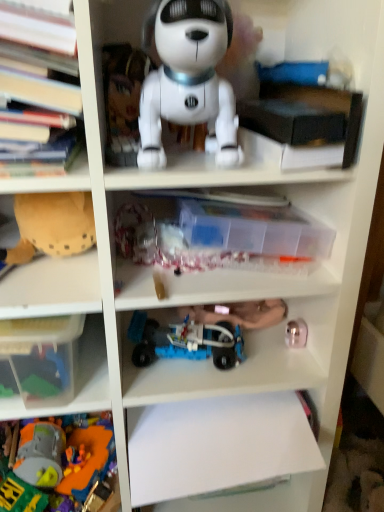
Question: Is translucent plastic storage box at lower left surrounded by hardcover books at left, the 3th book when ordered from right to left?

Choices:
 (A) no
 (B) yes

Answer: (A)

Question: Is hardcover books at left, which is counted as the 1th book, starting from the left, facing towards translucent plastic storage box at lower left?

Choices:
 (A) yes
 (B) no

Answer: (B)

Question: Does hardcover books at left, the 3th book when ordered from right to left, have a greater width compared to translucent plastic storage box at lower left?

Choices:
 (A) yes
 (B) no

Answer: (A)

Question: From a real-world perspective, is hardcover books at left, the 3th book when ordered from right to left, positioned under translucent plastic storage box at lower left based on gravity?

Choices:
 (A) no
 (B) yes

Answer: (A)

Question: Does hardcover books at left, which is counted as the 1th book, starting from the left, have a smaller size compared to translucent plastic storage box at lower left?

Choices:
 (A) yes
 (B) no

Answer: (B)

Question: From a real-world perspective, is blue plastic toy car at center, the 2th toy in the bottom-to-top sequence, above or below brown fabric toy at left, the fourth toy positioned from the bottom?

Choices:
 (A) below
 (B) above

Answer: (A)

Question: In terms of width, does blue plastic toy car at center, the 2th toy in the bottom-to-top sequence, look wider or thinner when compared to brown fabric toy at left, the fourth toy positioned from the bottom?

Choices:
 (A) thin
 (B) wide

Answer: (A)

Question: Considering the positions of blue plastic toy car at center, the fourth toy positioned from the top, and brown fabric toy at left, the fourth toy positioned from the bottom, in the image, is blue plastic toy car at center, the fourth toy positioned from the top, taller or shorter than brown fabric toy at left, the fourth toy positioned from the bottom,?

Choices:
 (A) tall
 (B) short

Answer: (B)

Question: From the image's perspective, is blue plastic toy car at center, the 2th toy in the bottom-to-top sequence, above or below brown fabric toy at left, the fourth toy positioned from the bottom?

Choices:
 (A) above
 (B) below

Answer: (B)

Question: From a real-world perspective, relative to hardcover books at left, the 3th book when ordered from right to left, is metallic gold toy at lower right, marked as the third toy in a bottom-to-top arrangement, vertically above or below?

Choices:
 (A) above
 (B) below

Answer: (B)

Question: Considering their positions, is metallic gold toy at lower right, marked as the third toy in a bottom-to-top arrangement, located in front of or behind hardcover books at left, which is counted as the 1th book, starting from the left?

Choices:
 (A) behind
 (B) front

Answer: (A)

Question: In terms of height, does metallic gold toy at lower right, positioned as the 3th toy in top-to-bottom order, look taller or shorter compared to hardcover books at left, the 3th book when ordered from right to left?

Choices:
 (A) short
 (B) tall

Answer: (A)

Question: From the image's perspective, is metallic gold toy at lower right, positioned as the 3th toy in top-to-bottom order, above or below hardcover books at left, which is counted as the 1th book, starting from the left?

Choices:
 (A) above
 (B) below

Answer: (B)

Question: Relative to brown fabric toy at left, the fourth toy positioned from the bottom, is metallic gold toy at lower right, positioned as the 3th toy in top-to-bottom order, in front or behind?

Choices:
 (A) behind
 (B) front

Answer: (A)

Question: From the image's perspective, is metallic gold toy at lower right, positioned as the 3th toy in top-to-bottom order, positioned above or below brown fabric toy at left, the fourth toy positioned from the bottom?

Choices:
 (A) above
 (B) below

Answer: (B)